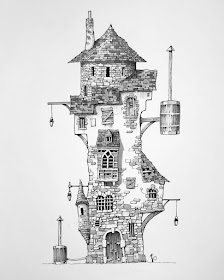
Where is `window`? window is located at coordinates (131, 230).